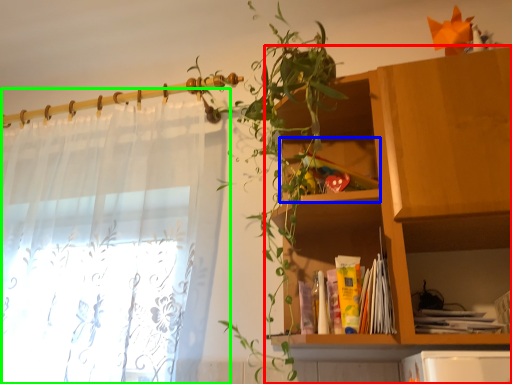
Question: Estimate the real-world distances between objects in this image. Which object is closer to shelf (highlighted by a red box), cabinet (highlighted by a blue box) or curtain (highlighted by a green box)?

Choices:
 (A) cabinet
 (B) curtain

Answer: (A)